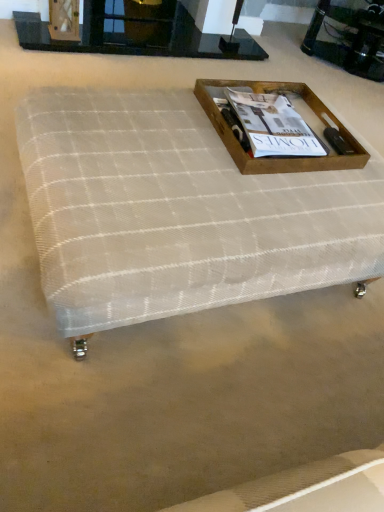
At what (x,y) coordinates should I click in order to perform the action: click on vacant area situated to the left side of wooden tray at center. Please return your answer as a coordinate pair (x, y). Looking at the image, I should click on (146, 120).